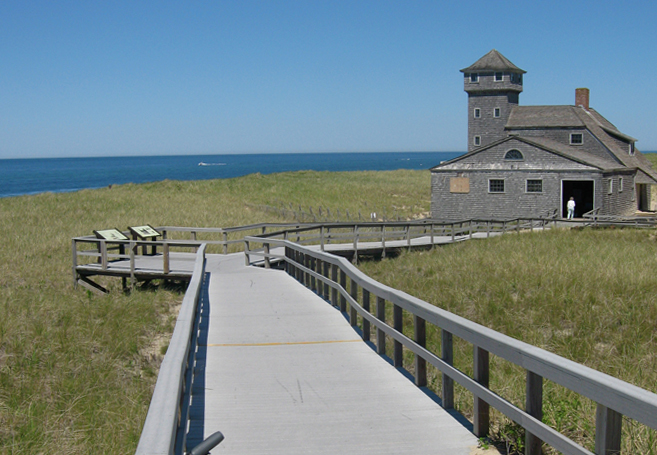
Identify the location of wood handrails. The width and height of the screenshot is (657, 455). (376, 288), (170, 377).